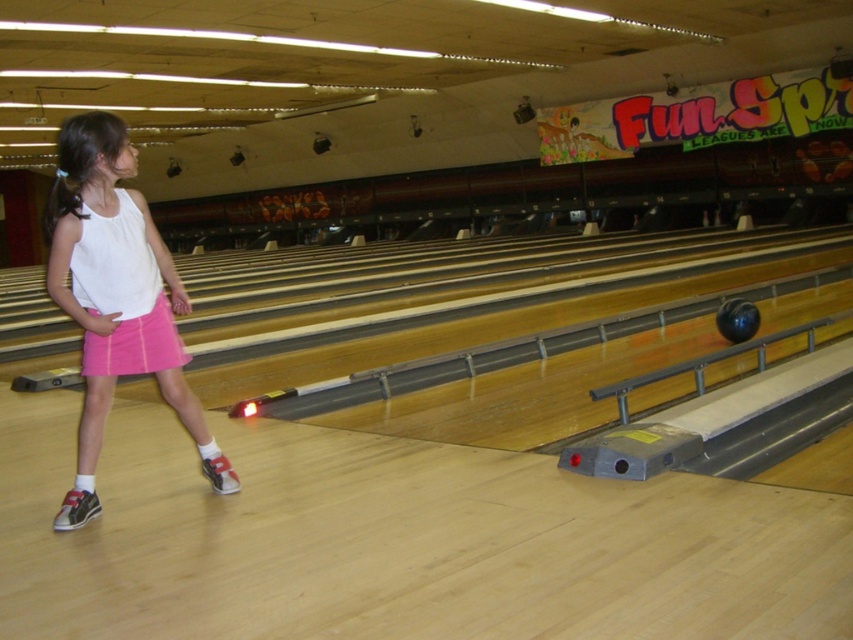
Question: Which point is farther from the camera taking this photo?

Choices:
 (A) (132, 237)
 (B) (91, 374)

Answer: (B)

Question: Does white matte tank top at center appear over pink cotton shorts at lower left?

Choices:
 (A) no
 (B) yes

Answer: (B)

Question: Does white matte tank top at center appear under pink cotton shorts at lower left?

Choices:
 (A) no
 (B) yes

Answer: (A)

Question: Can you confirm if white matte tank top at center is smaller than pink cotton shorts at lower left?

Choices:
 (A) yes
 (B) no

Answer: (B)